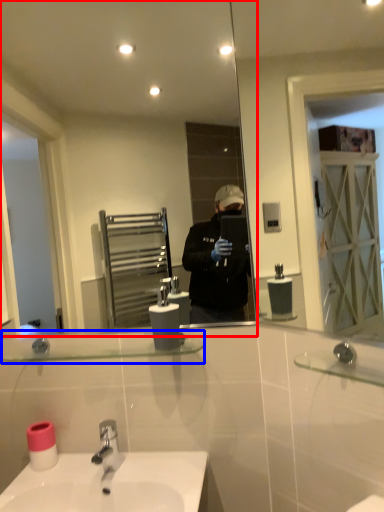
Question: Among these objects, which one is farthest to the camera, mirror (highlighted by a red box) or balustrade (highlighted by a blue box)?

Choices:
 (A) mirror
 (B) balustrade

Answer: (A)